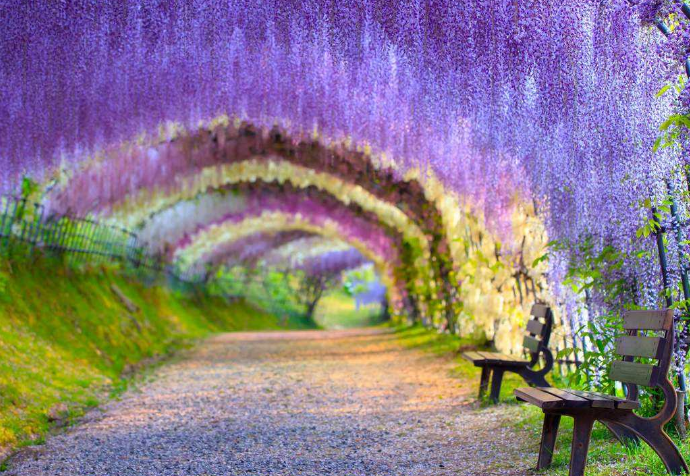
The image size is (690, 476). What are the coordinates of `yellow archway` in the screenshot? It's located at click(x=297, y=177).